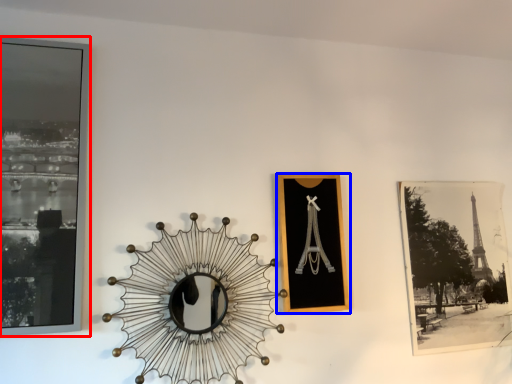
Question: Which point is closer to the camera, picture frame (highlighted by a red box) or picture frame (highlighted by a blue box)?

Choices:
 (A) picture frame
 (B) picture frame

Answer: (A)